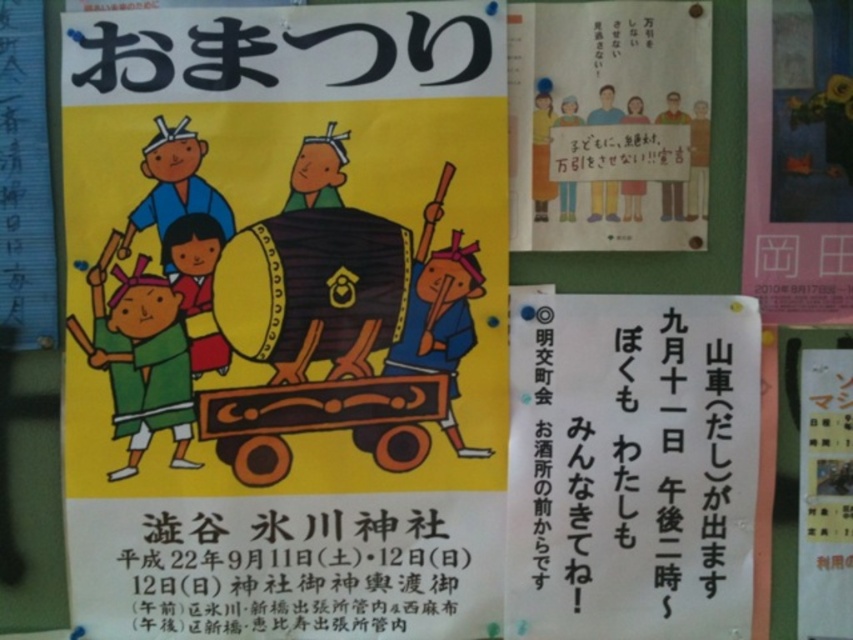
What do you see at coordinates (631, 465) in the screenshot? I see `black paper text at center` at bounding box center [631, 465].

Between point (662, 333) and point (279, 602), which one is positioned behind?

Point (279, 602)

Where is `black paper text at center`? This screenshot has width=853, height=640. black paper text at center is located at coordinates (631, 465).

In the scene shown: Between wooden drum at center and white paper poster at upper right, which one is positioned lower?

white paper poster at upper right

Between point (253, 68) and point (804, 476), which one is positioned in front?

Positioned in front is point (253, 68).

Find the location of a particular element. This screenshot has width=853, height=640. wooden drum at center is located at coordinates (285, 321).

Image resolution: width=853 pixels, height=640 pixels. What are the coordinates of `wooden drum at center` in the screenshot? It's located at (285, 321).

Is matte paper poster at upper center to the right of metallic gold frame at upper right from the viewer's perspective?

Incorrect, matte paper poster at upper center is not on the right side of metallic gold frame at upper right.

Is matte paper poster at upper center to the left of metallic gold frame at upper right from the viewer's perspective?

Yes, matte paper poster at upper center is to the left of metallic gold frame at upper right.

Between point (610, 244) and point (756, 208), which one is positioned in front?

Point (610, 244) is in front.

At what (x,y) coordinates should I click in order to perform the action: click on matte paper poster at upper center. Please return your answer as a coordinate pair (x, y). The image size is (853, 640). Looking at the image, I should click on (608, 124).